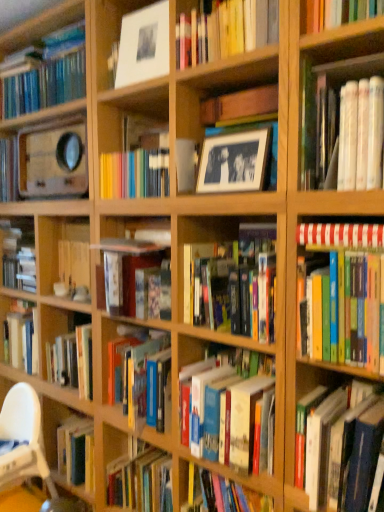
Question: Considering the relative sizes of white plastic chair at lower left and black matte picture frame at upper center in the image provided, is white plastic chair at lower left thinner than black matte picture frame at upper center?

Choices:
 (A) yes
 (B) no

Answer: (B)

Question: Is the position of white plastic chair at lower left less distant than that of black matte picture frame at upper center?

Choices:
 (A) yes
 (B) no

Answer: (B)

Question: Can you confirm if white plastic chair at lower left is bigger than black matte picture frame at upper center?

Choices:
 (A) no
 (B) yes

Answer: (B)

Question: Is white plastic chair at lower left at the right side of black matte picture frame at upper center?

Choices:
 (A) no
 (B) yes

Answer: (A)

Question: Is white plastic chair at lower left wider than black matte picture frame at upper center?

Choices:
 (A) no
 (B) yes

Answer: (B)

Question: Considering the positions of matte white frame at upper center, arranged as the 1th shelf when viewed from the top, and white plastic chair at lower left in the image, is matte white frame at upper center, arranged as the 1th shelf when viewed from the top, taller or shorter than white plastic chair at lower left?

Choices:
 (A) short
 (B) tall

Answer: (B)

Question: Is matte white frame at upper center, the 2th shelf positioned from the bottom, inside the boundaries of white plastic chair at lower left, or outside?

Choices:
 (A) inside
 (B) outside

Answer: (B)

Question: From a real-world perspective, relative to white plastic chair at lower left, is matte white frame at upper center, the 2th shelf when ordered from right to left, vertically above or below?

Choices:
 (A) above
 (B) below

Answer: (A)

Question: Is matte white frame at upper center, placed as the first shelf when sorted from left to right, to the left or to the right of white plastic chair at lower left in the image?

Choices:
 (A) left
 (B) right

Answer: (B)

Question: Is matte white frame at upper center, arranged as the 1th shelf when viewed from the top, to the left or to the right of black matte picture frame at upper center in the image?

Choices:
 (A) left
 (B) right

Answer: (A)

Question: From a real-world perspective, is matte white frame at upper center, placed as the first shelf when sorted from left to right, above or below black matte picture frame at upper center?

Choices:
 (A) below
 (B) above

Answer: (B)

Question: From the image's perspective, is matte white frame at upper center, arranged as the 1th shelf when viewed from the top, located above or below black matte picture frame at upper center?

Choices:
 (A) below
 (B) above

Answer: (B)

Question: Is matte white frame at upper center, the 2th shelf when ordered from right to left, wider or thinner than black matte picture frame at upper center?

Choices:
 (A) thin
 (B) wide

Answer: (B)

Question: Is white paper book at upper right, arranged as the sixth book when ordered from the bottom, in front of or behind hardcover book at right, placed as the first book when sorted from bottom to top, in the image?

Choices:
 (A) behind
 (B) front

Answer: (B)

Question: Considering the positions of point (382, 125) and point (370, 410), is point (382, 125) closer or farther from the camera than point (370, 410)?

Choices:
 (A) closer
 (B) farther

Answer: (A)